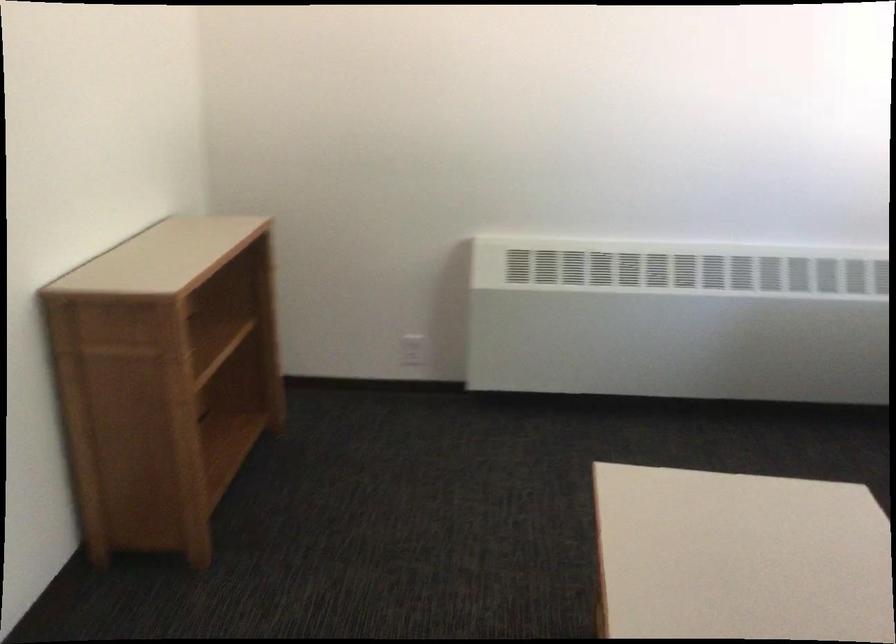
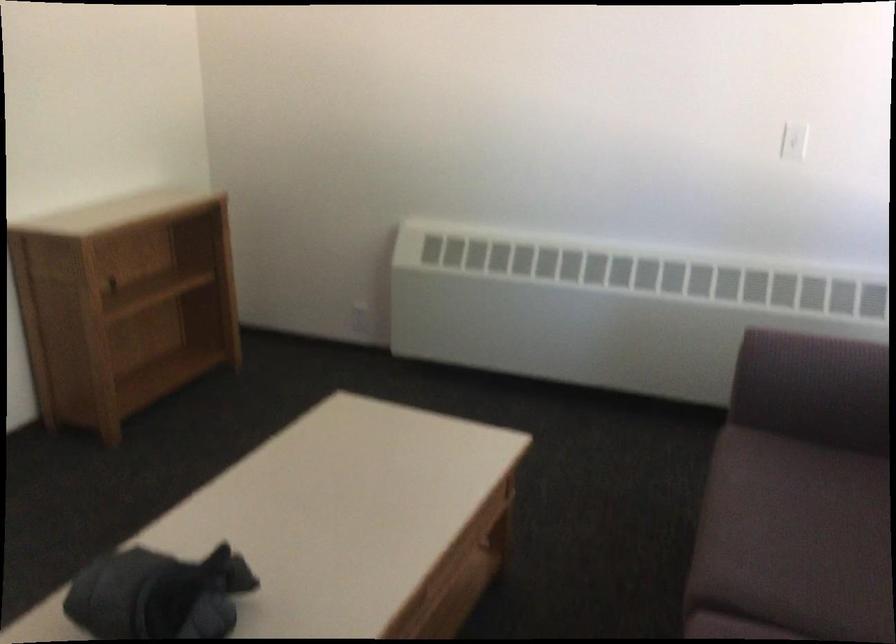
Question: What movement of the cameraman would produce the second image?

Choices:
 (A) Left
 (B) Right
 (C) Forward
 (D) Backward

Answer: (B)